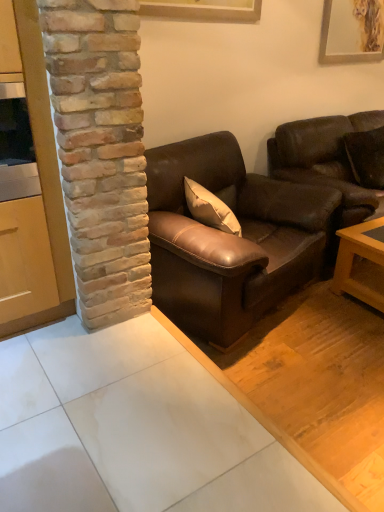
Describe the element at coordinates (203, 10) in the screenshot. Image resolution: width=384 pixels, height=512 pixels. I see `wooden picture frame at upper center, which ranks as the first picture frame in left-to-right order` at that location.

Find the location of a particular element. This screenshot has width=384, height=512. brown leather couch at center, the first studio couch from the left is located at coordinates (229, 238).

Find the location of a particular element. light brown wooden table at lower right is located at coordinates (363, 258).

In order to face matte gold picture frame at upper right, the first picture frame viewed from the back, should I rotate leftwards or rightwards?

To face it directly, rotate right by 21.662 degrees.

The image size is (384, 512). Find the location of `wooden picture frame at upper center, which ranks as the first picture frame in left-to-right order`. wooden picture frame at upper center, which ranks as the first picture frame in left-to-right order is located at coordinates (203, 10).

Could you tell me if matte gold picture frame at upper right, the first picture frame viewed from the back, is turned towards brown leather couch at center, the first studio couch from the left?

No, matte gold picture frame at upper right, the first picture frame viewed from the back, is not facing towards brown leather couch at center, the first studio couch from the left.

Are matte gold picture frame at upper right, which appears as the second picture frame when viewed from the left, and brown leather couch at center, the first studio couch from the left, far apart?

matte gold picture frame at upper right, which appears as the second picture frame when viewed from the left, is positioned a significant distance from brown leather couch at center, the first studio couch from the left.

Can you confirm if matte gold picture frame at upper right, the first picture frame viewed from the right, is thinner than brown leather couch at center, which ranks as the second studio couch in right-to-left order?

Correct, the width of matte gold picture frame at upper right, the first picture frame viewed from the right, is less than that of brown leather couch at center, which ranks as the second studio couch in right-to-left order.

Which of these two, matte gold picture frame at upper right, the first picture frame viewed from the right, or brown leather couch at center, which ranks as the second studio couch in right-to-left order, stands shorter?

matte gold picture frame at upper right, the first picture frame viewed from the right.

Which object is thinner, brown leather couch at center, the first studio couch from the left, or light brown wooden table at lower right?

light brown wooden table at lower right is thinner.

Is brown leather couch at center, which ranks as the second studio couch in right-to-left order, positioned in front of light brown wooden table at lower right?

Yes, it is in front of light brown wooden table at lower right.

From a real-world perspective, is brown leather couch at center, the first studio couch from the left, on light brown wooden table at lower right?

Yes, from a real-world perspective, brown leather couch at center, the first studio couch from the left, is over light brown wooden table at lower right

How different are the orientations of brown leather couch at center, the first studio couch from the left, and light brown wooden table at lower right in degrees?

17.5 degrees separate the facing orientations of brown leather couch at center, the first studio couch from the left, and light brown wooden table at lower right.

Between brown leather couch at center, the first studio couch from the left, and wooden cabinet at left, which one has larger width?

brown leather couch at center, the first studio couch from the left, is wider.

Which is behind, point (236, 216) or point (33, 39)?

The point (236, 216) is more distant.

Which of these two, brown leather couch at center, which ranks as the second studio couch in right-to-left order, or wooden cabinet at left, stands shorter?

Standing shorter between the two is brown leather couch at center, which ranks as the second studio couch in right-to-left order.

Is point (366, 46) positioned in front of point (34, 0)?

No, (366, 46) is further to viewer.

From a real-world perspective, is matte gold picture frame at upper right, which appears as the second picture frame when viewed from the left, on wooden cabinet at left?

Yes, from a real-world perspective, matte gold picture frame at upper right, which appears as the second picture frame when viewed from the left, is above wooden cabinet at left.

Considering the relative sizes of matte gold picture frame at upper right, the first picture frame viewed from the right, and wooden cabinet at left in the image provided, is matte gold picture frame at upper right, the first picture frame viewed from the right, bigger than wooden cabinet at left?

Incorrect, matte gold picture frame at upper right, the first picture frame viewed from the right, is not larger than wooden cabinet at left.

Is matte gold picture frame at upper right, the second picture frame in the front-to-back sequence, next to wooden cabinet at left?

No, matte gold picture frame at upper right, the second picture frame in the front-to-back sequence, is not with wooden cabinet at left.

Is light brown wooden table at lower right touching brown leather couch at right, marked as the first studio couch in a right-to-left arrangement?

No, light brown wooden table at lower right is not in contact with brown leather couch at right, marked as the first studio couch in a right-to-left arrangement.

Is light brown wooden table at lower right further to camera compared to brown leather couch at right, the second studio couch when ordered from left to right?

No, it is not.

Does light brown wooden table at lower right contain brown leather couch at right, marked as the first studio couch in a right-to-left arrangement?

No, brown leather couch at right, marked as the first studio couch in a right-to-left arrangement, is not surrounded by light brown wooden table at lower right.

Which is closer, (371, 261) or (326, 148)?

The point (371, 261) is in front.

Can you tell me how much matte gold picture frame at upper right, the first picture frame viewed from the back, and brown leather pillow at upper right differ in facing direction?

There is a 0.00603-degree angle between the facing directions of matte gold picture frame at upper right, the first picture frame viewed from the back, and brown leather pillow at upper right.

Does matte gold picture frame at upper right, the first picture frame viewed from the right, appear on the left side of brown leather pillow at upper right?

Indeed, matte gold picture frame at upper right, the first picture frame viewed from the right, is positioned on the left side of brown leather pillow at upper right.

Is matte gold picture frame at upper right, the first picture frame viewed from the back, wider than brown leather pillow at upper right?

No, matte gold picture frame at upper right, the first picture frame viewed from the back, is not wider than brown leather pillow at upper right.

Which object is closer to the camera taking this photo, matte gold picture frame at upper right, the first picture frame viewed from the right, or brown leather pillow at upper right?

brown leather pillow at upper right is more forward.

In terms of height, does matte gold picture frame at upper right, the second picture frame in the front-to-back sequence, look taller or shorter compared to light brown wooden table at lower right?

Clearly, matte gold picture frame at upper right, the second picture frame in the front-to-back sequence, is taller compared to light brown wooden table at lower right.

Is point (338, 17) farther from viewer compared to point (338, 272)?

Yes, it is behind point (338, 272).

Find the location of `studio couch that is the 2nd object directly below the matte gold picture frame at upper right, the second picture frame in the front-to-back sequence (from a real-world perspective)`. studio couch that is the 2nd object directly below the matte gold picture frame at upper right, the second picture frame in the front-to-back sequence (from a real-world perspective) is located at coordinates (229, 238).

At what (x,y) coordinates should I click in order to perform the action: click on table behind the brown leather couch at center, the first studio couch from the left. Please return your answer as a coordinate pair (x, y). This screenshot has height=512, width=384. Looking at the image, I should click on (363, 258).

From the image, which object appears to be nearer to light brown wooden table at lower right, wooden cabinet at left or wooden picture frame at upper center, positioned as the 2th picture frame in right-to-left order?

Among the two, wooden picture frame at upper center, positioned as the 2th picture frame in right-to-left order, is located nearer to light brown wooden table at lower right.

Based on their spatial positions, is brown leather pillow at upper right or brown leather couch at center, which ranks as the second studio couch in right-to-left order, further from wooden picture frame at upper center, positioned as the 2th picture frame in right-to-left order?

brown leather pillow at upper right is further to wooden picture frame at upper center, positioned as the 2th picture frame in right-to-left order.

When comparing their distances from wooden picture frame at upper center, which ranks as the first picture frame in left-to-right order, does brown leather couch at center, the first studio couch from the left, or brown leather couch at right, marked as the first studio couch in a right-to-left arrangement, seem further?

brown leather couch at center, the first studio couch from the left, is positioned further to the anchor wooden picture frame at upper center, which ranks as the first picture frame in left-to-right order.

Looking at the image, which one is located further to wooden picture frame at upper center, which is the 1th picture frame from front to back, brown leather couch at right, the second studio couch when ordered from left to right, or light brown wooden table at lower right?

The object further to wooden picture frame at upper center, which is the 1th picture frame from front to back, is light brown wooden table at lower right.

Looking at the image, which one is located further to brown leather couch at center, which ranks as the second studio couch in right-to-left order, matte gold picture frame at upper right, the second picture frame in the front-to-back sequence, or wooden cabinet at left?

Among the two, matte gold picture frame at upper right, the second picture frame in the front-to-back sequence, is located further to brown leather couch at center, which ranks as the second studio couch in right-to-left order.

Estimate the real-world distances between objects in this image. Which object is closer to wooden cabinet at left, brown leather pillow at upper right or light brown wooden table at lower right?

light brown wooden table at lower right is closer to wooden cabinet at left.

When comparing their distances from brown leather couch at right, the second studio couch when ordered from left to right, does wooden cabinet at left or brown leather couch at center, the first studio couch from the left, seem further?

wooden cabinet at left.

Which object lies further to the anchor point matte gold picture frame at upper right, the first picture frame viewed from the back, brown leather pillow at upper right or light brown wooden table at lower right?

light brown wooden table at lower right is positioned further to the anchor matte gold picture frame at upper right, the first picture frame viewed from the back.

Locate an element on the screen. Image resolution: width=384 pixels, height=512 pixels. table between wooden cabinet at left and matte gold picture frame at upper right, the second picture frame in the front-to-back sequence, in the horizontal direction is located at coordinates (363, 258).

The image size is (384, 512). In order to click on table between brown leather couch at center, the first studio couch from the left, and brown leather couch at right, the second studio couch when ordered from left to right, from left to right in this screenshot , I will do `click(363, 258)`.

Identify the location of studio couch situated between wooden picture frame at upper center, which is counted as the second picture frame, starting from the back, and brown leather pillow at upper right from left to right. The width and height of the screenshot is (384, 512). (229, 238).

Identify the location of picture frame between matte gold picture frame at upper right, the first picture frame viewed from the right, and light brown wooden table at lower right from top to bottom. The height and width of the screenshot is (512, 384). (203, 10).